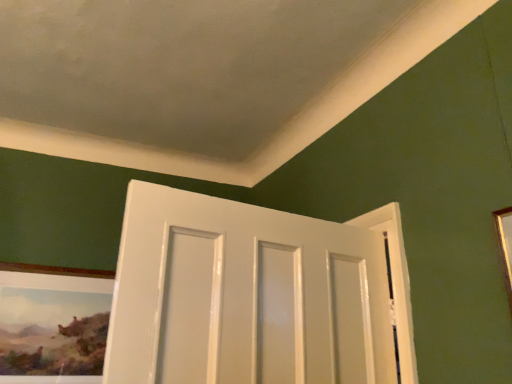
Where is `wooden framed painting at lower left`? The width and height of the screenshot is (512, 384). wooden framed painting at lower left is located at coordinates (53, 324).

What do you see at coordinates (53, 324) in the screenshot?
I see `wooden framed painting at lower left` at bounding box center [53, 324].

Find the location of `wooden framed painting at lower left`. wooden framed painting at lower left is located at coordinates (53, 324).